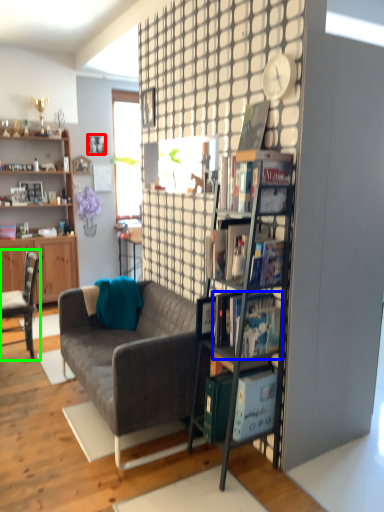
Question: Considering the real-world distances, which object is closest to picture frame (highlighted by a red box)? book (highlighted by a blue box) or chair (highlighted by a green box).

Choices:
 (A) book
 (B) chair

Answer: (B)